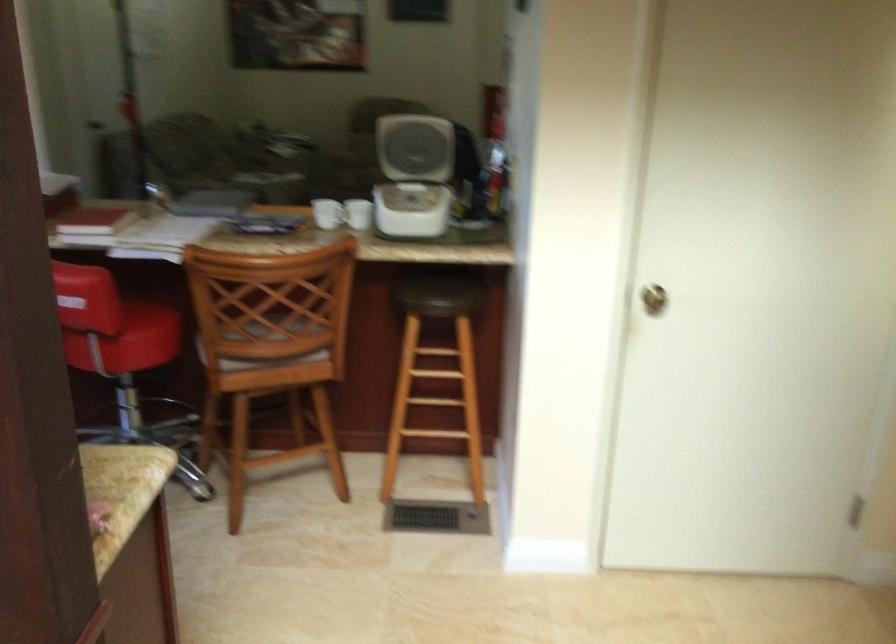
Where would you turn the brass door knob? Please return your answer as a coordinate pair (x, y).

(653, 299)